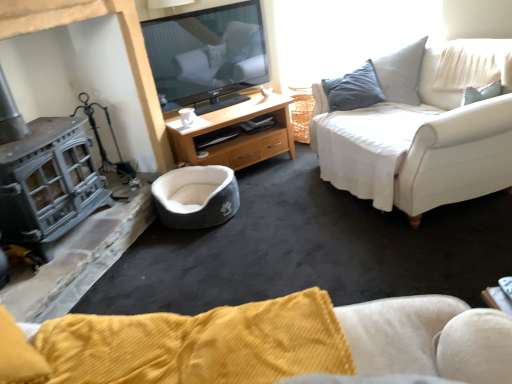
Question: Considering the positions of wooden tv stand at center and white fabric couch at right in the image, is wooden tv stand at center taller or shorter than white fabric couch at right?

Choices:
 (A) tall
 (B) short

Answer: (B)

Question: Is wooden tv stand at center wider or thinner than white fabric couch at right?

Choices:
 (A) thin
 (B) wide

Answer: (A)

Question: Considering the real-world distances, which object is closest to the gray plush pet bed at center?

Choices:
 (A) wooden tv stand at center
 (B) white fabric couch at right
 (C) white glossy coffee cup at center

Answer: (A)

Question: Based on their relative distances, which object is nearer to the gray plush pet bed at center?

Choices:
 (A) wooden tv stand at center
 (B) white fabric couch at right
 (C) white glossy coffee cup at center

Answer: (A)